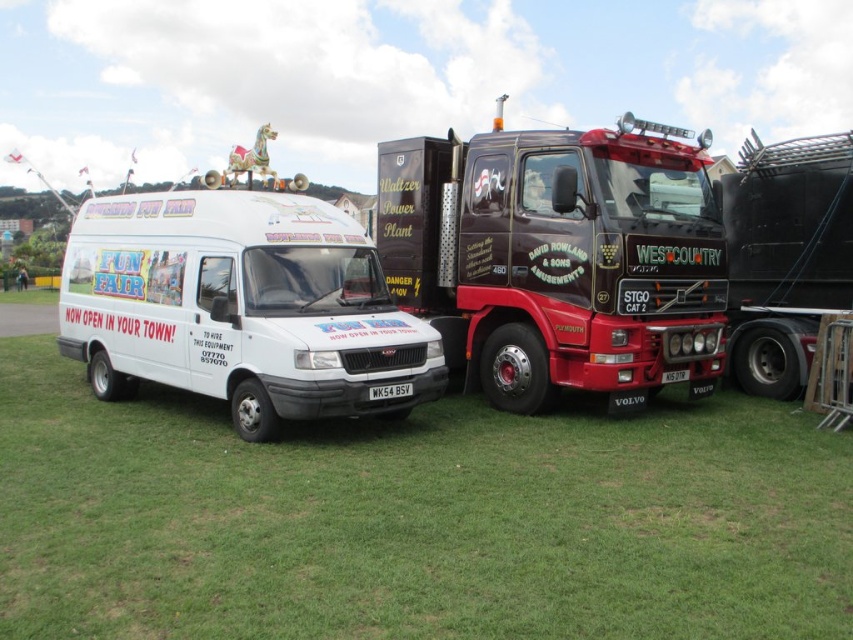
You are a photographer planning to take a photo of the white glossy van at left and the black textured trailer truck at right parked on the grassy field. To ensure both vehicles are fully visible in the frame, which vehicle should you position closer to the camera?

The white glossy van at left should be positioned closer to the camera because it is positioned under the black textured trailer truck at right, so moving it forward will prevent it from being blocked by the truck.

Looking at this image, you are standing at the center of the grassy field and want to locate the white glossy van at left. What are the coordinates where you should look?

The white glossy van at left is located at coordinates point [241,307].